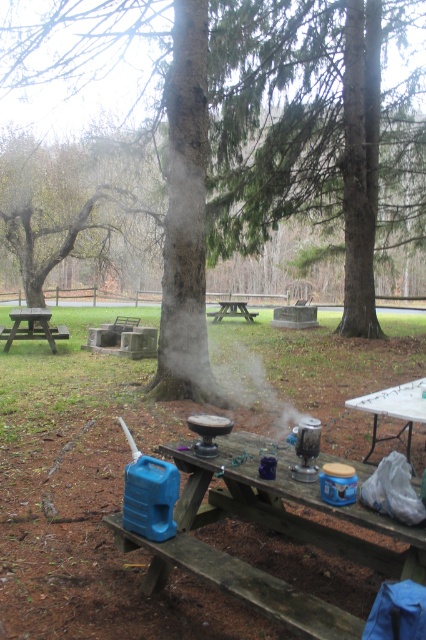
Does smooth bark tree at upper left have a smaller size compared to brown wooden picnic table at center?

No.

Does smooth bark tree at upper left appear on the right side of brown wooden picnic table at center?

Incorrect, smooth bark tree at upper left is not on the right side of brown wooden picnic table at center.

Find the location of a particular element. smooth bark tree at upper left is located at coordinates (81, 212).

Does white plastic table at center have a larger size compared to brown wooden picnic table at center?

Yes.

What do you see at coordinates (394, 410) in the screenshot? Image resolution: width=426 pixels, height=640 pixels. I see `white plastic table at center` at bounding box center [394, 410].

Where is `white plastic table at center`? This screenshot has height=640, width=426. white plastic table at center is located at coordinates (394, 410).

Can you confirm if wooden picnic table at left is wider than brown wooden picnic table at center?

No.

Is wooden picnic table at left to the left of brown wooden picnic table at center from the viewer's perspective?

Indeed, wooden picnic table at left is positioned on the left side of brown wooden picnic table at center.

What do you see at coordinates (31, 326) in the screenshot?
I see `wooden picnic table at left` at bounding box center [31, 326].

You are a GUI agent. You are given a task and a screenshot of the screen. Output one action in this format:
    pyautogui.click(x=<x>, y=<y>)
    Task: Click on the wooden picnic table at left
    This screenshot has width=426, height=640.
    Given the screenshot: What is the action you would take?
    pyautogui.click(x=31, y=326)